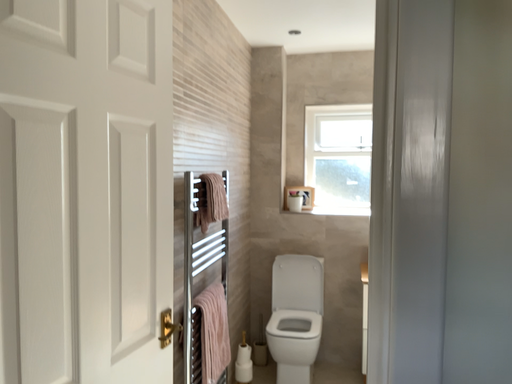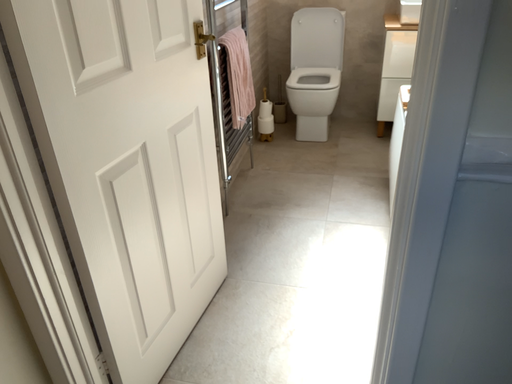
Question: How did the camera likely rotate when shooting the video?

Choices:
 (A) rotated downward
 (B) rotated upward

Answer: (A)